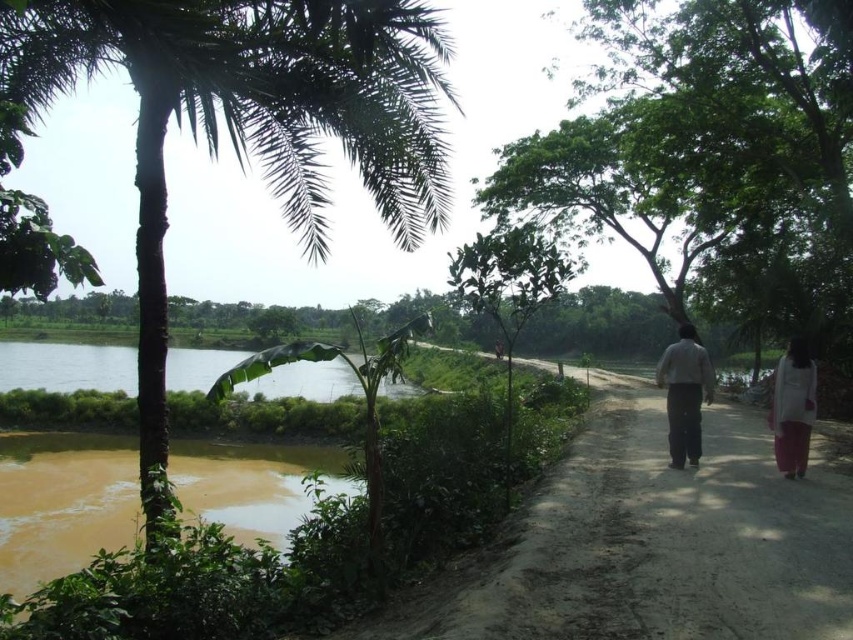
Can you confirm if dirt road at center is wider than green leafy tree at center?

In fact, dirt road at center might be narrower than green leafy tree at center.

Is point (572, 541) positioned in front of point (747, 4)?

Yes, point (572, 541) is closer to viewer.

At what (x,y) coordinates should I click in order to perform the action: click on dirt road at center. Please return your answer as a coordinate pair (x, y). This screenshot has height=640, width=853. Looking at the image, I should click on (650, 541).

Who is more forward, (506, 205) or (706, 388)?

Positioned in front is point (706, 388).

Does green leafy tree at center have a greater width compared to dark gray pants at center?

Yes.

You are a GUI agent. You are given a task and a screenshot of the screen. Output one action in this format:
    pyautogui.click(x=<x>, y=<y>)
    Task: Click on the green leafy tree at center
    This screenshot has height=640, width=853.
    Given the screenshot: What is the action you would take?
    pyautogui.click(x=709, y=147)

Does green leafy palm tree at left have a larger size compared to dark gray pants at center?

Yes, green leafy palm tree at left is bigger than dark gray pants at center.

Measure the distance from green leafy palm tree at left to dark gray pants at center.

A distance of 11.92 meters exists between green leafy palm tree at left and dark gray pants at center.

Is point (306, 22) closer to viewer compared to point (676, 444)?

That is True.

The height and width of the screenshot is (640, 853). Find the location of `green leafy palm tree at left`. green leafy palm tree at left is located at coordinates (244, 122).